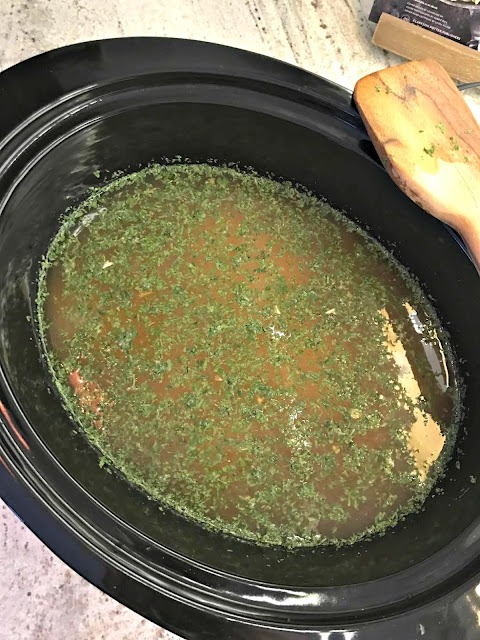
The height and width of the screenshot is (640, 480). Find the location of `black rim of pot`. black rim of pot is located at coordinates (115, 580).